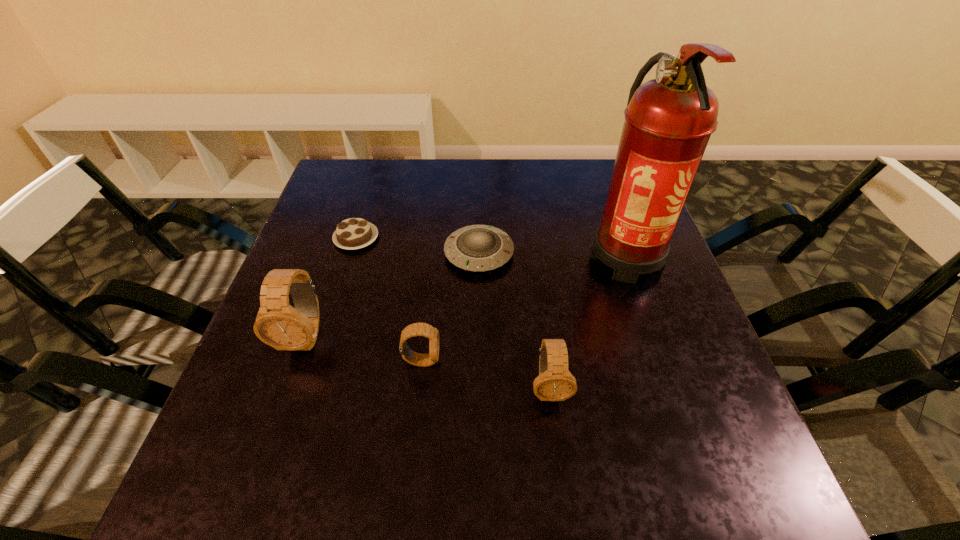
The image size is (960, 540). Find the location of `vacant space at the far edge of the desktop`. vacant space at the far edge of the desktop is located at coordinates (492, 191).

Find the location of a particular element. The width and height of the screenshot is (960, 540). blank space at the near edge of the desktop is located at coordinates point(371,441).

Identify the location of vacant region at the left edge of the desktop. This screenshot has width=960, height=540. (297, 370).

Find the location of a particular element. vacant region at the right edge of the desktop is located at coordinates (647, 341).

The height and width of the screenshot is (540, 960). I want to click on vacant area at the far left corner of the desktop, so click(362, 203).

The width and height of the screenshot is (960, 540). What are the coordinates of `vacant space at the far right corner of the desktop` in the screenshot? It's located at (608, 166).

The image size is (960, 540). Identify the location of free space that is in between the shortest object and the saucer. (418, 246).

Where is `empty location between the shortest object and the second tallest object`? empty location between the shortest object and the second tallest object is located at coordinates (331, 287).

Where is `vacant area that lies between the leftmost watch and the shortest object`? vacant area that lies between the leftmost watch and the shortest object is located at coordinates (331, 287).

Find the location of a particular element. free space that is in between the chocolate cake and the second tallest object is located at coordinates (331, 287).